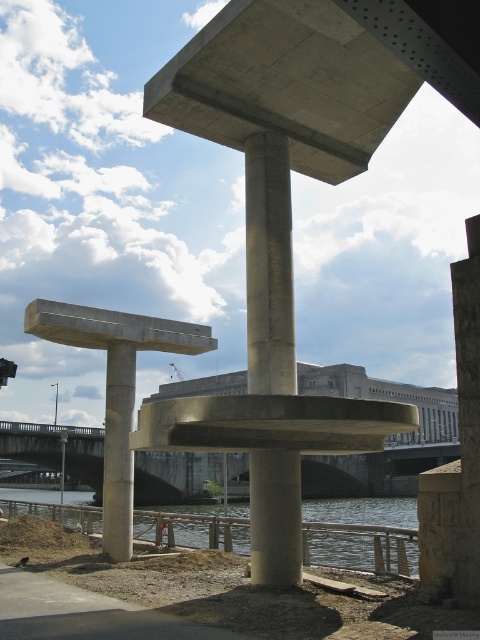
Between concrete at center and concrete/rough pillar at lower center, which one has less height?

concrete/rough pillar at lower center

Can you confirm if concrete at center is positioned to the left of concrete/rough pillar at lower center?

In fact, concrete at center is to the right of concrete/rough pillar at lower center.

You are a GUI agent. You are given a task and a screenshot of the screen. Output one action in this format:
    pyautogui.click(x=<x>, y=<y>)
    Task: Click on the concrete at center
    
    Given the screenshot: What is the action you would take?
    pyautogui.click(x=268, y=266)

Is point (228, 538) positioned behind point (104, 467)?

No, it is in front of (104, 467).

Can you confirm if clear water at lower center is taller than concrete/rough pillar at lower center?

Yes, clear water at lower center is taller than concrete/rough pillar at lower center.

Who is more forward, (182, 529) or (127, 529)?

Point (127, 529) is in front.

This screenshot has height=640, width=480. Identify the location of clear water at lower center. (360, 547).

Where is `concrete bridge at center`? The image size is (480, 640). concrete bridge at center is located at coordinates (372, 470).

Which is behind, point (52, 440) or point (119, 392)?

The point (52, 440) is behind.

Where is `concrete bridge at center`? Image resolution: width=480 pixels, height=640 pixels. concrete bridge at center is located at coordinates (372, 470).

Locate an element on the screen. The height and width of the screenshot is (640, 480). concrete bridge at center is located at coordinates (372, 470).